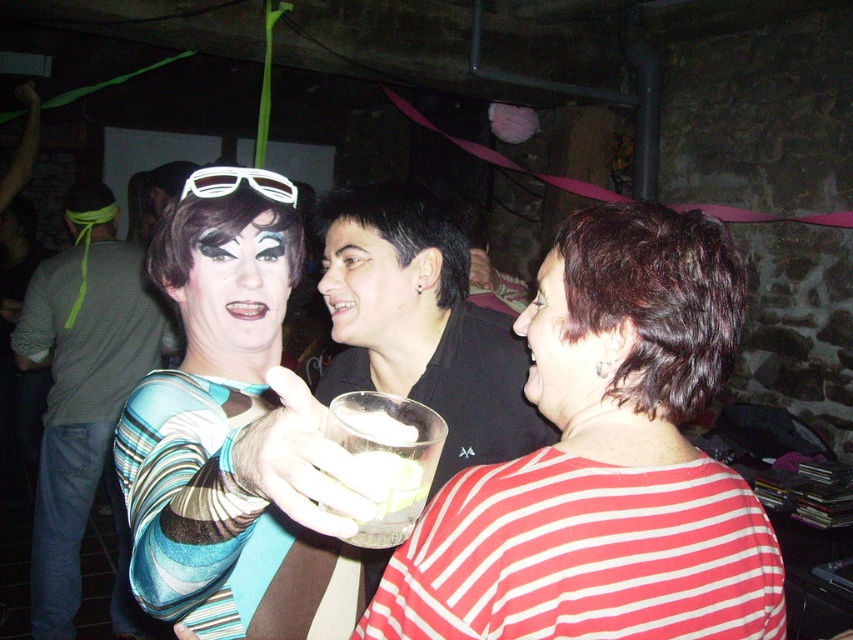
Does smooth skin face at center have a larger size compared to white plastic goggles at upper center?

Correct, smooth skin face at center is larger in size than white plastic goggles at upper center.

Consider the image. Who is more forward, (372, 310) or (236, 182)?

Point (236, 182)

Is point (358, 317) in front of point (202, 170)?

No, (358, 317) is behind (202, 170).

Identify the location of smooth skin face at center. (374, 289).

Does matte black face at center lie in front of matte black hair at center?

That is False.

You are a GUI agent. You are given a task and a screenshot of the screen. Output one action in this format:
    pyautogui.click(x=<x>, y=<y>)
    Task: Click on the matte black face at center
    This screenshot has width=853, height=640.
    Given the screenshot: What is the action you would take?
    pyautogui.click(x=236, y=292)

Which is in front, point (190, 360) or point (523, 317)?

Point (523, 317) is more forward.

At what (x,y) coordinates should I click in order to perform the action: click on matte black face at center. Please return your answer as a coordinate pair (x, y). Looking at the image, I should click on (236, 292).

Is striped fabric shirt at left closer to camera compared to white plastic goggles at upper center?

No, striped fabric shirt at left is further to the viewer.

Does point (64, 604) come closer to viewer compared to point (207, 179)?

No.

The height and width of the screenshot is (640, 853). I want to click on striped fabric shirt at left, so (x=84, y=400).